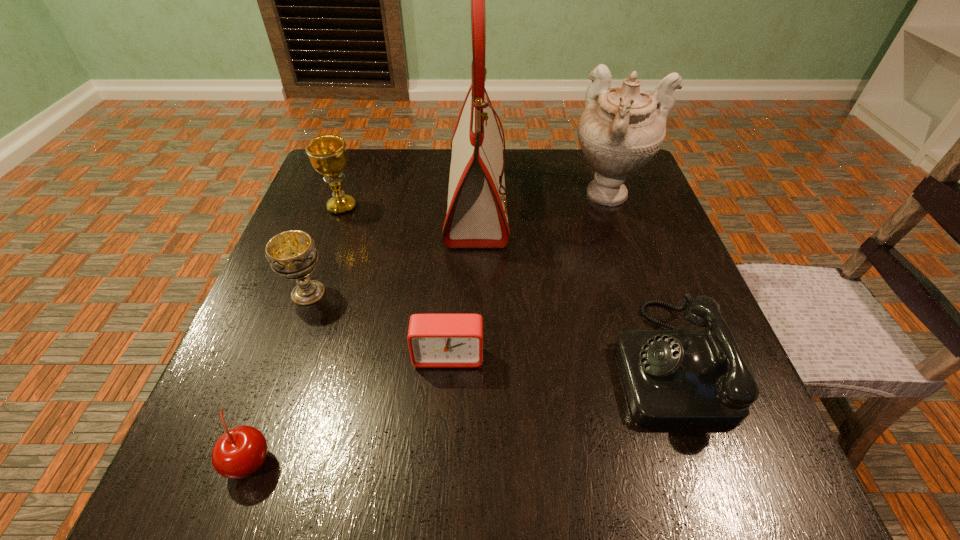
Locate an element on the screen. handbag is located at coordinates (477, 217).

Locate an element on the screen. urn is located at coordinates (621, 129).

What are the coordinates of `the farther chalice` in the screenshot? It's located at tap(327, 153).

The width and height of the screenshot is (960, 540). Identify the location of the taller chalice. (327, 153).

Locate an element on the screen. telephone is located at coordinates (672, 378).

The image size is (960, 540). What are the coordinates of `the nearer chalice` in the screenshot? It's located at (292, 254).

Identify the location of alarm clock. Image resolution: width=960 pixels, height=540 pixels. (435, 340).

Identify the location of cherry. The image size is (960, 540). (239, 452).

Identify the location of free space located 0.150m on the front of the handbag. Image resolution: width=960 pixels, height=540 pixels. (475, 303).

Locate an element on the screen. This screenshot has height=540, width=960. blank area located 0.070m on the back of the second tallest object is located at coordinates (597, 159).